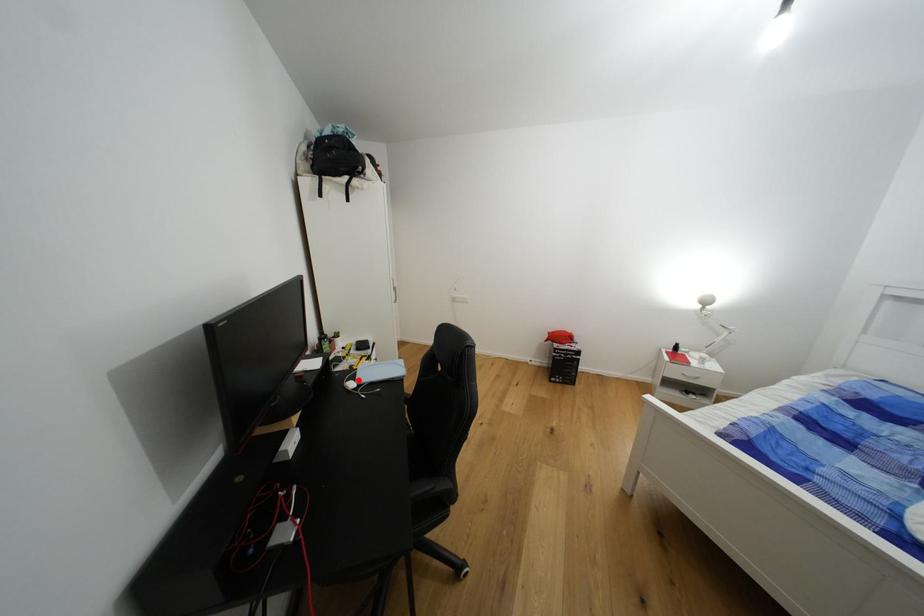
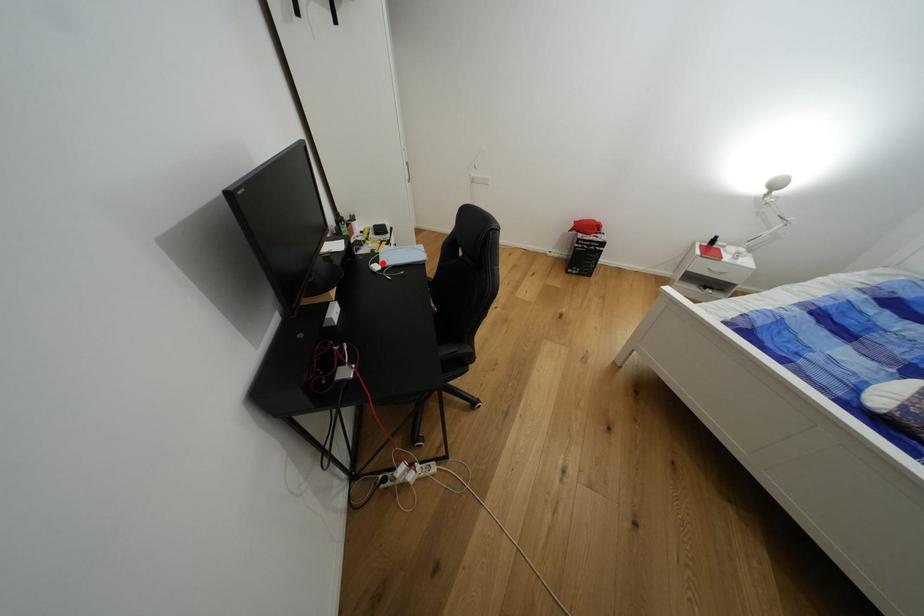
I am providing you with two images of the same scene from different viewpoints. A red point is marked on the first image and another point is marked on the second image. Do the highlighted points in image1 and image2 indicate the same real-world spot?

Yes